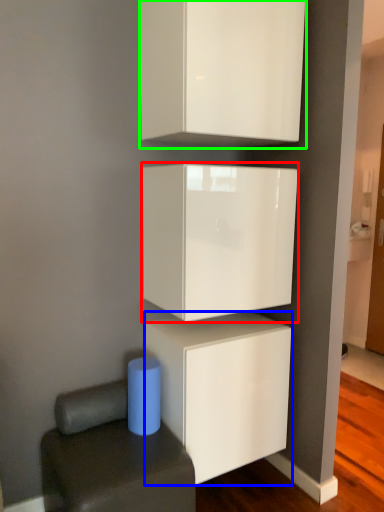
Question: Estimate the real-world distances between objects in this image. Which object is closer to cabinetry (highlighted by a red box), cabinetry (highlighted by a blue box) or cabinetry (highlighted by a green box)?

Choices:
 (A) cabinetry
 (B) cabinetry

Answer: (A)